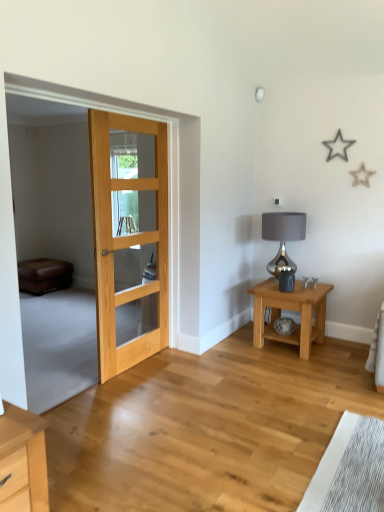
Find the location of a particular element. free location to the right of natural wood door at left is located at coordinates (189, 367).